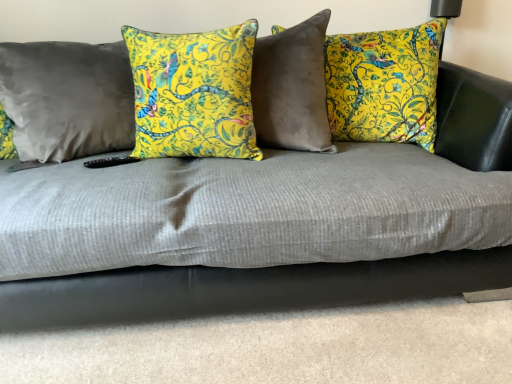
What do you see at coordinates (384, 84) in the screenshot? The height and width of the screenshot is (384, 512). I see `yellow floral pillow at center, the first pillow in the right-to-left sequence` at bounding box center [384, 84].

In order to face satin gray pillow at left, placed as the 1th pillow when sorted from left to right, should I rotate leftwards or rightwards?

You should look left and rotate roughly 25.951 degrees.

Locate an element on the screen. The image size is (512, 384). satin gray pillow at left, placed as the 1th pillow when sorted from left to right is located at coordinates (67, 98).

Locate an element on the screen. This screenshot has width=512, height=384. yellow floral pillow at center, which is the third pillow in left-to-right order is located at coordinates click(384, 84).

How far apart are satin gray pillow at left, the third pillow in the right-to-left sequence, and yellow floral pillow at center, the second pillow positioned from the left?

satin gray pillow at left, the third pillow in the right-to-left sequence, is 24.27 centimeters from yellow floral pillow at center, the second pillow positioned from the left.

Would you say satin gray pillow at left, placed as the 1th pillow when sorted from left to right, is inside or outside yellow floral pillow at center, the second pillow viewed from the right?

satin gray pillow at left, placed as the 1th pillow when sorted from left to right, is not inside yellow floral pillow at center, the second pillow viewed from the right, it's outside.

Is satin gray pillow at left, the third pillow in the right-to-left sequence, positioned before yellow floral pillow at center, the second pillow positioned from the left?

No.

What's the angular difference between yellow floral pillow at center, the second pillow viewed from the right, and yellow floral pillow at center, the first pillow in the right-to-left sequence,'s facing directions?

They differ by 2.81 degrees in their facing directions.

From a real-world perspective, starting from the yellow floral pillow at center, the second pillow positioned from the left, which pillow is the 2nd one below it? Please provide its 2D coordinates.

[(384, 84)]

Consider the image. Is yellow floral pillow at center, the second pillow viewed from the right, taller or shorter than yellow floral pillow at center, the first pillow in the right-to-left sequence?

In the image, yellow floral pillow at center, the second pillow viewed from the right, appears to be shorter than yellow floral pillow at center, the first pillow in the right-to-left sequence.

From a real-world perspective, is yellow floral pillow at center, the second pillow viewed from the right, on top of yellow floral pillow at center, which is the third pillow in left-to-right order?

Yes, from a real-world perspective, yellow floral pillow at center, the second pillow viewed from the right, is on top of yellow floral pillow at center, which is the third pillow in left-to-right order.

Is satin gray pillow at left, the third pillow in the right-to-left sequence, oriented towards yellow floral pillow at center, the first pillow in the right-to-left sequence?

No, satin gray pillow at left, the third pillow in the right-to-left sequence, is not aimed at yellow floral pillow at center, the first pillow in the right-to-left sequence.

Considering the sizes of objects satin gray pillow at left, the third pillow in the right-to-left sequence, and yellow floral pillow at center, the first pillow in the right-to-left sequence, in the image provided, who is bigger, satin gray pillow at left, the third pillow in the right-to-left sequence, or yellow floral pillow at center, the first pillow in the right-to-left sequence,?

With larger size is yellow floral pillow at center, the first pillow in the right-to-left sequence.

From a real-world perspective, which is physically above, satin gray pillow at left, placed as the 1th pillow when sorted from left to right, or yellow floral pillow at center, the first pillow in the right-to-left sequence?

From a 3D spatial view, satin gray pillow at left, placed as the 1th pillow when sorted from left to right, is above.

Is satin gray pillow at left, placed as the 1th pillow when sorted from left to right, with yellow floral pillow at center, the first pillow in the right-to-left sequence?

No, satin gray pillow at left, placed as the 1th pillow when sorted from left to right, is not with yellow floral pillow at center, the first pillow in the right-to-left sequence.

From a real-world perspective, which is physically above, yellow floral pillow at center, the second pillow positioned from the left, or satin gray pillow at left, the third pillow in the right-to-left sequence?

yellow floral pillow at center, the second pillow positioned from the left.

Is yellow floral pillow at center, the second pillow viewed from the right, placed right next to satin gray pillow at left, the third pillow in the right-to-left sequence?

No, yellow floral pillow at center, the second pillow viewed from the right, is not touching satin gray pillow at left, the third pillow in the right-to-left sequence.

Between yellow floral pillow at center, the second pillow positioned from the left, and satin gray pillow at left, placed as the 1th pillow when sorted from left to right, which one has larger size?

satin gray pillow at left, placed as the 1th pillow when sorted from left to right.

Relative to satin gray pillow at left, the third pillow in the right-to-left sequence, is yellow floral pillow at center, the second pillow positioned from the left, in front or behind?

yellow floral pillow at center, the second pillow positioned from the left, is positioned closer to the viewer than satin gray pillow at left, the third pillow in the right-to-left sequence.

Is yellow floral pillow at center, which is the third pillow in left-to-right order, oriented towards yellow floral pillow at center, the second pillow positioned from the left?

No, yellow floral pillow at center, which is the third pillow in left-to-right order, does not turn towards yellow floral pillow at center, the second pillow positioned from the left.

Measure the distance from yellow floral pillow at center, which is the third pillow in left-to-right order, to yellow floral pillow at center, the second pillow positioned from the left.

yellow floral pillow at center, which is the third pillow in left-to-right order, is 21.62 inches away from yellow floral pillow at center, the second pillow positioned from the left.

From a real-world perspective, between yellow floral pillow at center, the first pillow in the right-to-left sequence, and yellow floral pillow at center, the second pillow viewed from the right, who is vertically higher?

yellow floral pillow at center, the second pillow viewed from the right.

Can you confirm if yellow floral pillow at center, which is the third pillow in left-to-right order, is taller than yellow floral pillow at center, the second pillow viewed from the right?

Indeed, yellow floral pillow at center, which is the third pillow in left-to-right order, has a greater height compared to yellow floral pillow at center, the second pillow viewed from the right.

Is yellow floral pillow at center, the first pillow in the right-to-left sequence, situated inside satin gray pillow at left, placed as the 1th pillow when sorted from left to right, or outside?

The correct answer is: outside.

Is yellow floral pillow at center, the first pillow in the right-to-left sequence, closer to camera compared to satin gray pillow at left, placed as the 1th pillow when sorted from left to right?

No, the depth of yellow floral pillow at center, the first pillow in the right-to-left sequence, is greater than that of satin gray pillow at left, placed as the 1th pillow when sorted from left to right.

From the image's perspective, starting from the yellow floral pillow at center, the first pillow in the right-to-left sequence, which pillow is the 1st one below? Please provide its 2D coordinates.

[(67, 98)]

Considering the sizes of objects yellow floral pillow at center, the first pillow in the right-to-left sequence, and satin gray pillow at left, placed as the 1th pillow when sorted from left to right, in the image provided, who is wider, yellow floral pillow at center, the first pillow in the right-to-left sequence, or satin gray pillow at left, placed as the 1th pillow when sorted from left to right,?

With larger width is yellow floral pillow at center, the first pillow in the right-to-left sequence.

Where is `pillow to the left of yellow floral pillow at center, the second pillow positioned from the left`? pillow to the left of yellow floral pillow at center, the second pillow positioned from the left is located at coordinates (67, 98).

You are a GUI agent. You are given a task and a screenshot of the screen. Output one action in this format:
    pyautogui.click(x=<x>, y=<y>)
    Task: Click on the 2nd pillow located above the yellow floral pillow at center, which is the third pillow in left-to-right order (from a real-world perspective)
    Image resolution: width=512 pixels, height=384 pixels.
    Given the screenshot: What is the action you would take?
    pyautogui.click(x=193, y=93)

Based on their spatial positions, is satin gray pillow at left, the third pillow in the right-to-left sequence, or yellow floral pillow at center, which is the third pillow in left-to-right order, further from yellow floral pillow at center, the second pillow positioned from the left?

Among the two, yellow floral pillow at center, which is the third pillow in left-to-right order, is located further to yellow floral pillow at center, the second pillow positioned from the left.

When comparing their distances from yellow floral pillow at center, the first pillow in the right-to-left sequence, does yellow floral pillow at center, the second pillow viewed from the right, or satin gray pillow at left, placed as the 1th pillow when sorted from left to right, seem further?

satin gray pillow at left, placed as the 1th pillow when sorted from left to right, lies further to yellow floral pillow at center, the first pillow in the right-to-left sequence, than the other object.

From the image, which object appears to be farther from yellow floral pillow at center, the first pillow in the right-to-left sequence, satin gray pillow at left, the third pillow in the right-to-left sequence, or yellow floral pillow at center, the second pillow positioned from the left?

satin gray pillow at left, the third pillow in the right-to-left sequence, is further to yellow floral pillow at center, the first pillow in the right-to-left sequence.

Considering their positions, is yellow floral pillow at center, the second pillow viewed from the right, positioned closer to satin gray pillow at left, placed as the 1th pillow when sorted from left to right, than yellow floral pillow at center, which is the third pillow in left-to-right order?

Based on the image, yellow floral pillow at center, the second pillow viewed from the right, appears to be nearer to satin gray pillow at left, placed as the 1th pillow when sorted from left to right.

Estimate the real-world distances between objects in this image. Which object is closer to yellow floral pillow at center, the second pillow viewed from the right, yellow floral pillow at center, which is the third pillow in left-to-right order, or satin gray pillow at left, the third pillow in the right-to-left sequence?

satin gray pillow at left, the third pillow in the right-to-left sequence, is closer to yellow floral pillow at center, the second pillow viewed from the right.

From the image, which object appears to be farther from satin gray pillow at left, placed as the 1th pillow when sorted from left to right, yellow floral pillow at center, which is the third pillow in left-to-right order, or yellow floral pillow at center, the second pillow positioned from the left?

yellow floral pillow at center, which is the third pillow in left-to-right order.

Where is `pillow between satin gray pillow at left, the third pillow in the right-to-left sequence, and yellow floral pillow at center, which is the third pillow in left-to-right order`? pillow between satin gray pillow at left, the third pillow in the right-to-left sequence, and yellow floral pillow at center, which is the third pillow in left-to-right order is located at coordinates (193, 93).